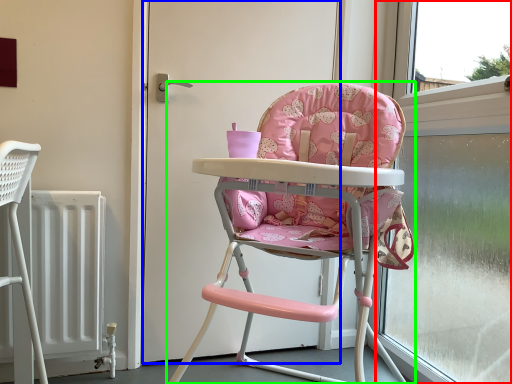
Question: Considering the real-world distances, which object is closest to window frame (highlighted by a red box)? door (highlighted by a blue box) or chair (highlighted by a green box).

Choices:
 (A) door
 (B) chair

Answer: (B)